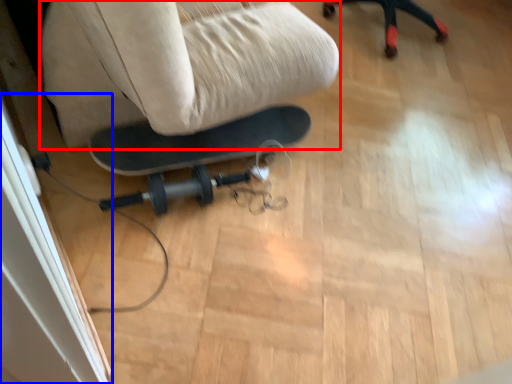
Question: Which object is closer to the camera taking this photo, swivel chair (highlighted by a red box) or screen door (highlighted by a blue box)?

Choices:
 (A) swivel chair
 (B) screen door

Answer: (A)